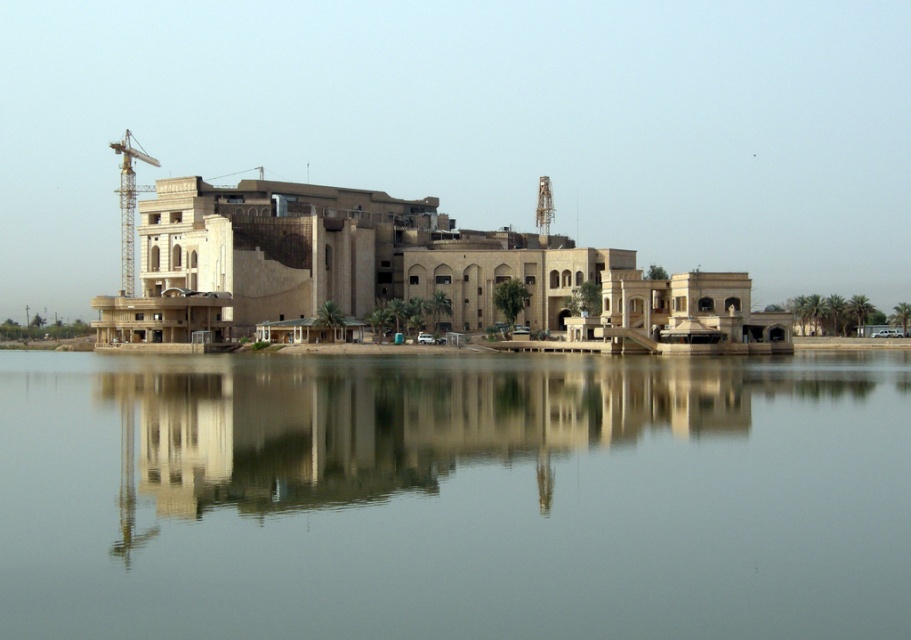
Is beige stone building at center to the left of yellow metallic crane at left from the viewer's perspective?

No, beige stone building at center is not to the left of yellow metallic crane at left.

In the scene shown: Measure the distance between point (485,230) and camera.

Point (485,230) and camera are 742.88 feet apart from each other.

Is point (210, 292) positioned before point (125, 182)?

Yes, it is in front of point (125, 182).

Find the location of a particular element. beige stone building at center is located at coordinates (405, 275).

Between smooth gray water at center and beige stone building at center, which one is positioned lower?

smooth gray water at center is lower down.

Which is more to the right, smooth gray water at center or beige stone building at center?

smooth gray water at center

Who is more distant from viewer, (x=783, y=470) or (x=408, y=262)?

The point (x=408, y=262) is more distant.

This screenshot has width=911, height=640. Find the location of `smooth gray water at center`. smooth gray water at center is located at coordinates [x=453, y=497].

Which is more to the right, smooth gray water at center or yellow metallic crane at left?

Positioned to the right is smooth gray water at center.

Locate an element on the screen. The width and height of the screenshot is (911, 640). smooth gray water at center is located at coordinates (453, 497).

Is point (459, 374) behind point (144, 189)?

No, it is not.

Find the location of a particular element. The image size is (911, 640). smooth gray water at center is located at coordinates (453, 497).